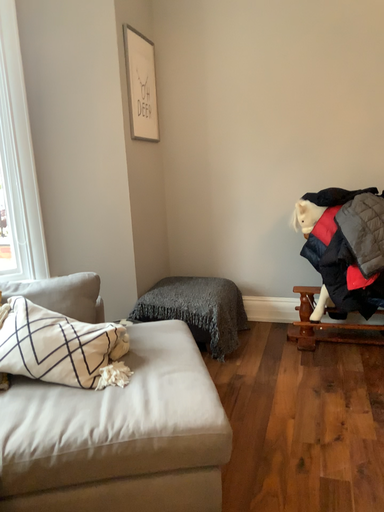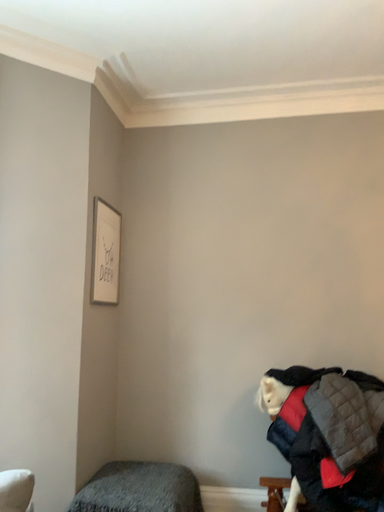
Question: Which way did the camera rotate in the video?

Choices:
 (A) rotated upward
 (B) rotated downward

Answer: (A)